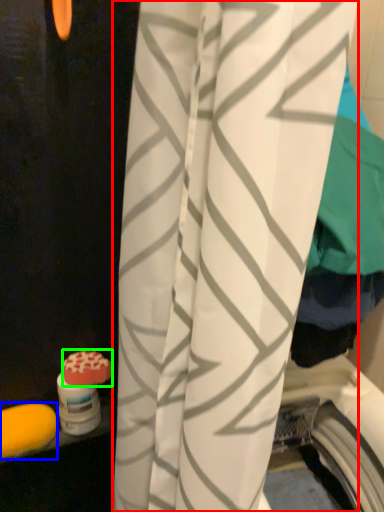
Question: Which object is positioned closest to curtain (highlighted by a red box)? Select from soap (highlighted by a blue box) and soap (highlighted by a green box).

Choices:
 (A) soap
 (B) soap

Answer: (B)